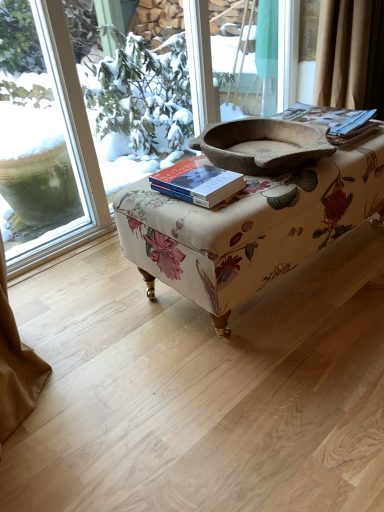
You are a GUI agent. You are given a task and a screenshot of the screen. Output one action in this format:
    pyautogui.click(x=<x>, y=<y>)
    Task: Click on the vacant space to the left of floral fabric ottoman at center
    This screenshot has height=512, width=384.
    Given the screenshot: What is the action you would take?
    [x=85, y=312]